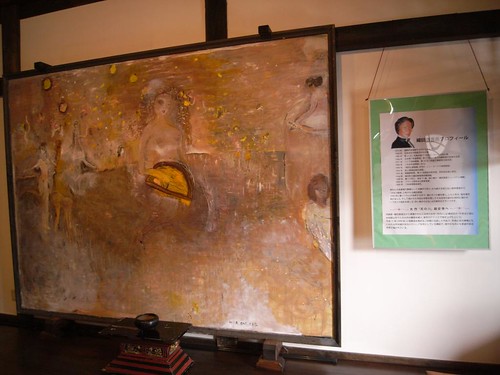
Locate an element on the screen. wall is located at coordinates (397, 301).